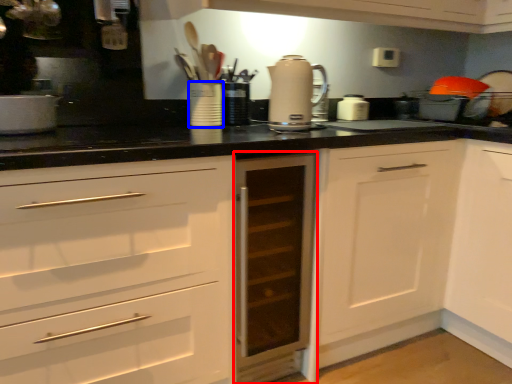
Question: Which point is further to the camera, cabinetry (highlighted by a red box) or appliance (highlighted by a blue box)?

Choices:
 (A) cabinetry
 (B) appliance

Answer: (B)